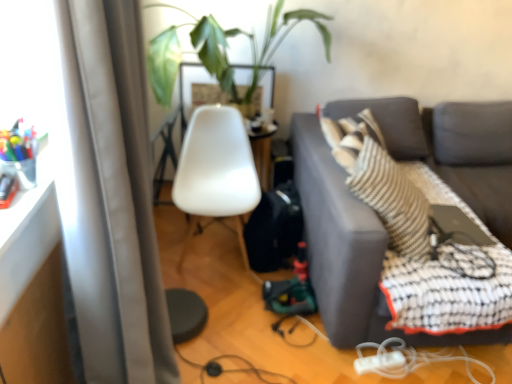
Question: Is dark gray fabric couch at right positioned beyond the bounds of satin gray curtain at left?

Choices:
 (A) yes
 (B) no

Answer: (A)

Question: From a real-world perspective, is dark gray fabric couch at right on satin gray curtain at left?

Choices:
 (A) no
 (B) yes

Answer: (A)

Question: From the image's perspective, would you say dark gray fabric couch at right is shown under satin gray curtain at left?

Choices:
 (A) no
 (B) yes

Answer: (B)

Question: Can you confirm if dark gray fabric couch at right is taller than satin gray curtain at left?

Choices:
 (A) yes
 (B) no

Answer: (B)

Question: Is dark gray fabric couch at right behind satin gray curtain at left?

Choices:
 (A) yes
 (B) no

Answer: (A)

Question: Considering the relative sizes of dark gray fabric couch at right and satin gray curtain at left in the image provided, is dark gray fabric couch at right bigger than satin gray curtain at left?

Choices:
 (A) yes
 (B) no

Answer: (A)

Question: Could you tell me if dark gray fabric couch at right is facing black rubber cable at lower center, arranged as the 2th cable when viewed from the right?

Choices:
 (A) yes
 (B) no

Answer: (B)

Question: From a real-world perspective, is dark gray fabric couch at right on black rubber cable at lower center, which appears as the 1th cable when viewed from the left?

Choices:
 (A) no
 (B) yes

Answer: (B)

Question: Is dark gray fabric couch at right touching black rubber cable at lower center, which appears as the 1th cable when viewed from the left?

Choices:
 (A) yes
 (B) no

Answer: (B)

Question: Is dark gray fabric couch at right wider than black rubber cable at lower center, which appears as the 1th cable when viewed from the left?

Choices:
 (A) yes
 (B) no

Answer: (A)

Question: Considering the relative positions of dark gray fabric couch at right and black rubber cable at lower center, which appears as the 1th cable when viewed from the left, in the image provided, is dark gray fabric couch at right to the right of black rubber cable at lower center, which appears as the 1th cable when viewed from the left, from the viewer's perspective?

Choices:
 (A) yes
 (B) no

Answer: (A)

Question: Considering the relative sizes of dark gray fabric couch at right and black rubber cable at lower center, arranged as the 2th cable when viewed from the right, in the image provided, is dark gray fabric couch at right bigger than black rubber cable at lower center, arranged as the 2th cable when viewed from the right,?

Choices:
 (A) no
 (B) yes

Answer: (B)

Question: Considering the relative sizes of black rubber cable at lower center, arranged as the 2th cable when viewed from the right, and satin gray curtain at left in the image provided, is black rubber cable at lower center, arranged as the 2th cable when viewed from the right, thinner than satin gray curtain at left?

Choices:
 (A) no
 (B) yes

Answer: (A)